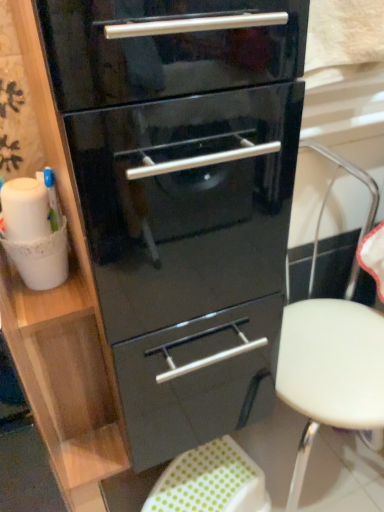
Locate an element on the screen. This screenshot has width=384, height=512. free spot above green polka dot fabric step stool at lower center (from a real-world perspective) is located at coordinates (207, 477).